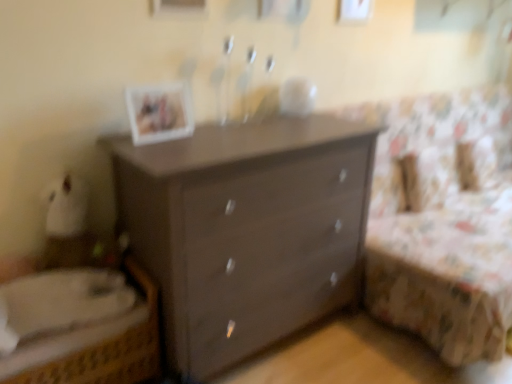
Describe the element at coordinates (96, 348) in the screenshot. This screenshot has height=384, width=512. I see `woven wicker bed at lower left` at that location.

What is the approximate height of matte white picture frame at upper center?

9.86 inches.

Locate an element on the screen. Image resolution: width=512 pixels, height=384 pixels. woven wicker bed at lower left is located at coordinates (96, 348).

Are woven wicker bed at lower left and matte white picture frame at upper center making contact?

woven wicker bed at lower left and matte white picture frame at upper center are not in contact.

Locate an element on the screen. bed below the matte white picture frame at upper center (from the image's perspective) is located at coordinates (96, 348).

Is woven wicker bed at lower left wider or thinner than matte white picture frame at upper center?

Considering their sizes, woven wicker bed at lower left looks broader than matte white picture frame at upper center.

Based on the photo, from a real-world perspective, is woven wicker bed at lower left on matte white picture frame at upper center?

No.

Is woven wicker bed at lower left a part of matte white picture frame at upper center?

Actually, woven wicker bed at lower left is outside matte white picture frame at upper center.

In the scene shown: Which of these two, matte white picture frame at upper center or woven wicker bed at lower left, is smaller?

With smaller size is matte white picture frame at upper center.

From the image's perspective, who appears lower, matte white picture frame at upper center or woven wicker bed at lower left?

woven wicker bed at lower left.

Is matte white picture frame at upper center positioned far away from woven wicker bed at lower left?

matte white picture frame at upper center is near woven wicker bed at lower left, not far away.

Which of these two, matte brown dresser at center or matte white picture frame at upper center, is thinner?

Thinner between the two is matte white picture frame at upper center.

Is matte white picture frame at upper center inside matte brown dresser at center?

No, matte white picture frame at upper center is not a part of matte brown dresser at center.

From a real-world perspective, is matte brown dresser at center positioned above or below matte white picture frame at upper center?

From a real-world perspective, matte brown dresser at center is physically below matte white picture frame at upper center.

From the picture: Which of these two, woven wicker bed at lower left or floral fabric bed at right, stands shorter?

woven wicker bed at lower left is shorter.

Is woven wicker bed at lower left facing away from floral fabric bed at right?

No, woven wicker bed at lower left is not facing the opposite direction of floral fabric bed at right.

From the image's perspective, is woven wicker bed at lower left on floral fabric bed at right?

No.

Is woven wicker bed at lower left to the right of floral fabric bed at right from the viewer's perspective?

No, woven wicker bed at lower left is not to the right of floral fabric bed at right.

Is floral fabric bed at right situated inside woven wicker bed at lower left or outside?

floral fabric bed at right is located beyond the bounds of woven wicker bed at lower left.

Is floral fabric bed at right at the right side of woven wicker bed at lower left?

Yes, floral fabric bed at right is to the right of woven wicker bed at lower left.

From the picture: From the image's perspective, does floral fabric bed at right appear lower than woven wicker bed at lower left?

No.

Is floral fabric bed at right bigger or smaller than woven wicker bed at lower left?

Considering their sizes, floral fabric bed at right takes up more space than woven wicker bed at lower left.

Considering the relative sizes of matte white picture frame at upper center and matte brown dresser at center in the image provided, is matte white picture frame at upper center taller than matte brown dresser at center?

No.

Can matte brown dresser at center be found inside matte white picture frame at upper center?

No, matte white picture frame at upper center does not contain matte brown dresser at center.

Which point is more forward, (164,138) or (352,253)?

The point (164,138) is closer.

From the image's perspective, which object appears higher, matte brown dresser at center or floral fabric bed at right?

floral fabric bed at right is shown above in the image.

In terms of height, does matte brown dresser at center look taller or shorter compared to floral fabric bed at right?

Clearly, matte brown dresser at center is taller compared to floral fabric bed at right.

Does matte brown dresser at center have a larger size compared to floral fabric bed at right?

No, matte brown dresser at center is not bigger than floral fabric bed at right.

Identify the location of bed that appears below the matte white picture frame at upper center (from a real-world perspective). Image resolution: width=512 pixels, height=384 pixels. (96, 348).

You are a GUI agent. You are given a task and a screenshot of the screen. Output one action in this format:
    pyautogui.click(x=<x>, y=<y>)
    Task: Click on the picture frame that is on the right side of woven wicker bed at lower left
    
    Given the screenshot: What is the action you would take?
    pyautogui.click(x=159, y=112)

Estimate the real-world distances between objects in this image. Which object is further from floral fabric bed at right, woven wicker bed at lower left or matte brown dresser at center?

woven wicker bed at lower left is positioned further to the anchor floral fabric bed at right.

Estimate the real-world distances between objects in this image. Which object is further from floral fabric bed at right, matte white picture frame at upper center or woven wicker bed at lower left?

The object further to floral fabric bed at right is woven wicker bed at lower left.

Looking at the image, which one is located closer to matte white picture frame at upper center, floral fabric bed at right or matte brown dresser at center?

Among the two, matte brown dresser at center is located nearer to matte white picture frame at upper center.

Based on their spatial positions, is woven wicker bed at lower left or matte brown dresser at center further from matte white picture frame at upper center?

woven wicker bed at lower left.

Based on their spatial positions, is matte white picture frame at upper center or woven wicker bed at lower left further from matte brown dresser at center?

matte white picture frame at upper center lies further to matte brown dresser at center than the other object.

Based on their spatial positions, is matte brown dresser at center or floral fabric bed at right further from woven wicker bed at lower left?

Among the two, floral fabric bed at right is located further to woven wicker bed at lower left.

Considering their positions, is matte brown dresser at center positioned further to floral fabric bed at right than woven wicker bed at lower left?

woven wicker bed at lower left is positioned further to the anchor floral fabric bed at right.

Which object lies further to the anchor point woven wicker bed at lower left, floral fabric bed at right or matte brown dresser at center?

floral fabric bed at right.

What are the coordinates of `picture frame situated between woven wicker bed at lower left and floral fabric bed at right from left to right` in the screenshot? It's located at (159, 112).

At what (x,y) coordinates should I click in order to perform the action: click on the chest of drawers that lies between matte white picture frame at upper center and woven wicker bed at lower left from top to bottom. Please return your answer as a coordinate pair (x, y). This screenshot has width=512, height=384. Looking at the image, I should click on (246, 230).

The height and width of the screenshot is (384, 512). Find the location of `chest of drawers between matte white picture frame at upper center and floral fabric bed at right`. chest of drawers between matte white picture frame at upper center and floral fabric bed at right is located at coordinates (246, 230).

The width and height of the screenshot is (512, 384). I want to click on chest of drawers between woven wicker bed at lower left and floral fabric bed at right, so click(x=246, y=230).